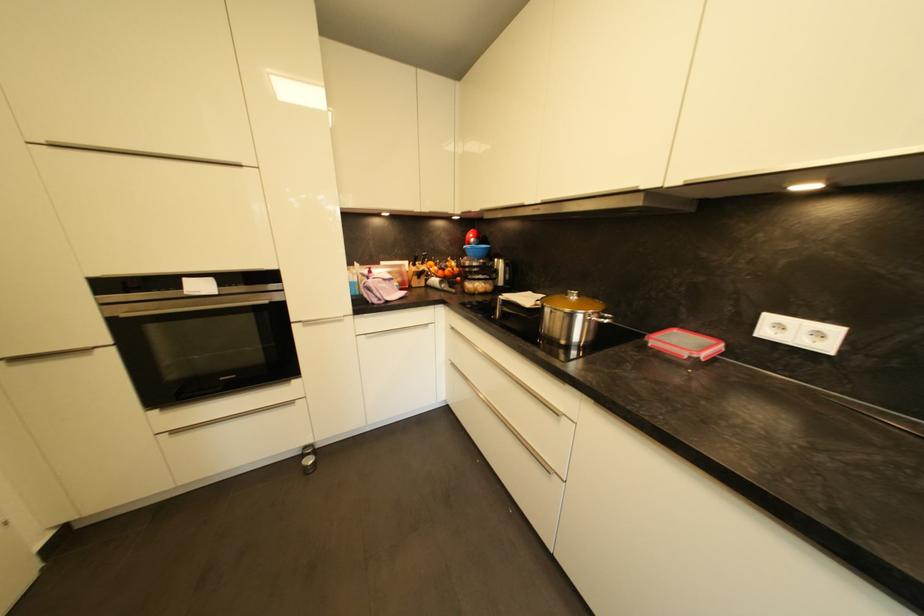
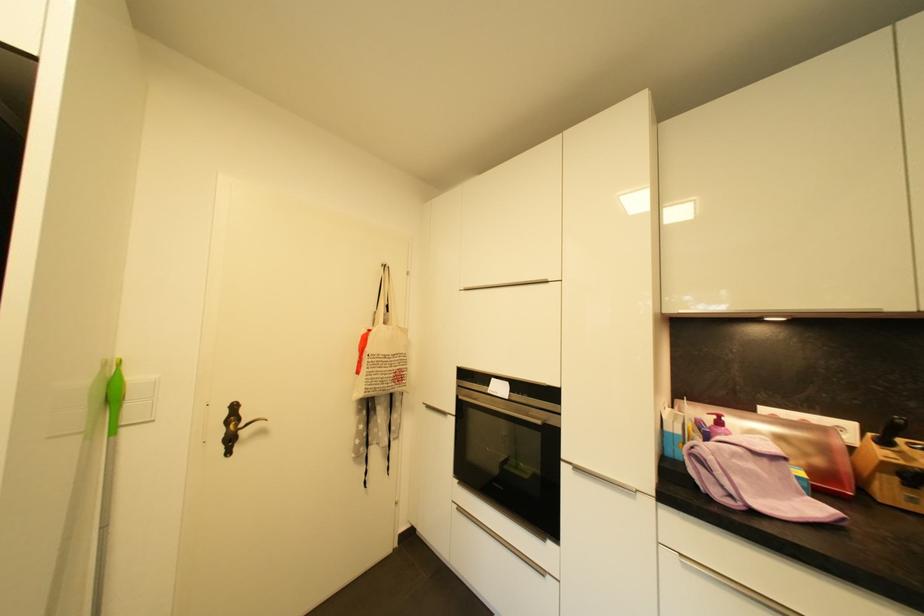
Find the pixel in the second image that matches pixel 419 267 in the first image.

(890, 445)